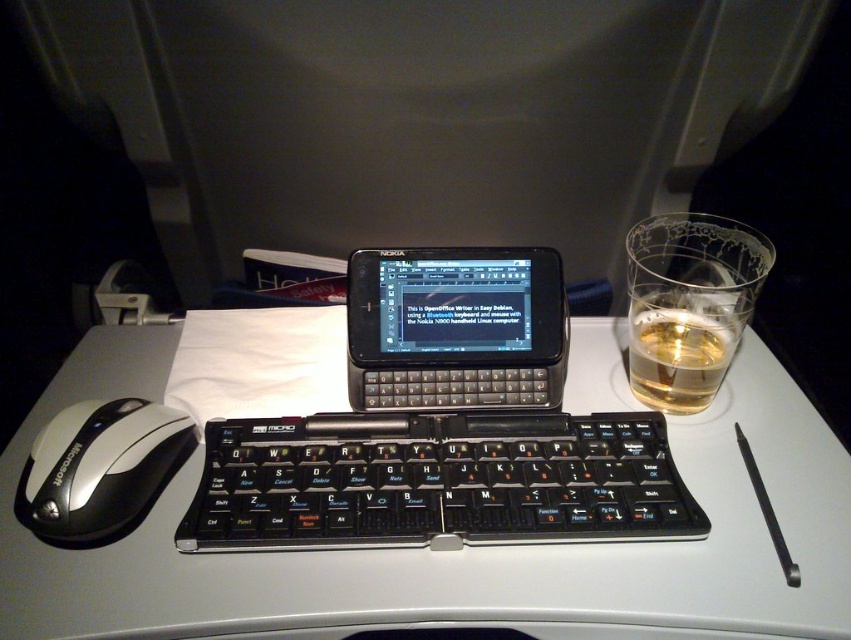
Who is more distant from viewer, (455, 352) or (55, 461)?

The point (455, 352) is behind.

Measure the distance between black plastic nokia phone at center and silver/plastic/mouse at left.

They are 9.53 inches apart.

Who is more forward, (561,369) or (16,515)?

→ Positioned in front is point (16,515).

Where is `black plastic nokia phone at center`? black plastic nokia phone at center is located at coordinates (455, 326).

Is translucent glass at right closer to camera compared to silver/plastic/mouse at left?

No.

Who is positioned more to the left, translucent glass at right or silver/plastic/mouse at left?

From the viewer's perspective, silver/plastic/mouse at left appears more on the left side.

Is point (740, 333) closer to camera compared to point (21, 500)?

No, it is behind (21, 500).

Where is `translucent glass at right`? translucent glass at right is located at coordinates (689, 305).

Can you confirm if white plastic table at center is taller than black plastic keyboard at center?

Correct, white plastic table at center is much taller as black plastic keyboard at center.

Find the location of `white plastic table at center`. white plastic table at center is located at coordinates (427, 500).

Where is `white plastic table at center`? This screenshot has width=851, height=640. white plastic table at center is located at coordinates point(427,500).